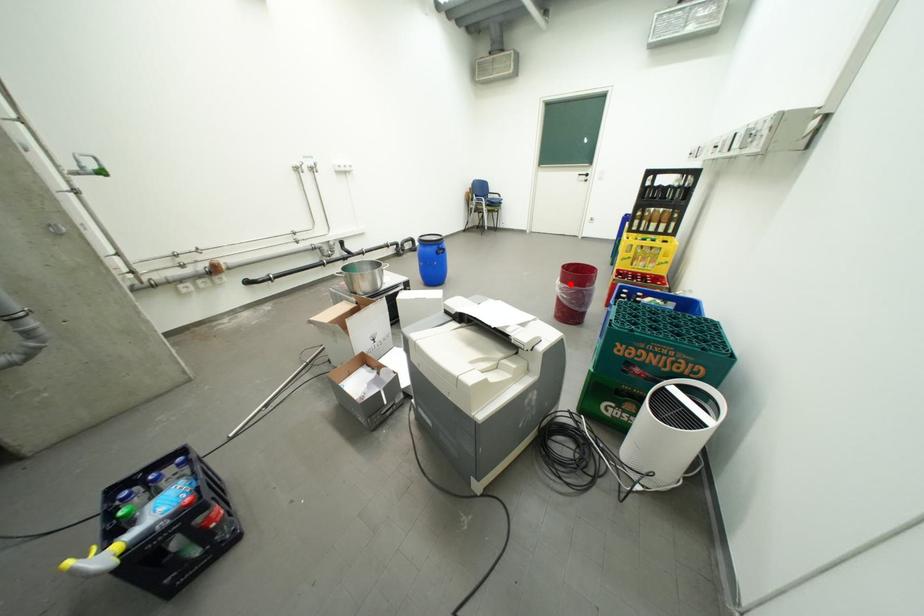
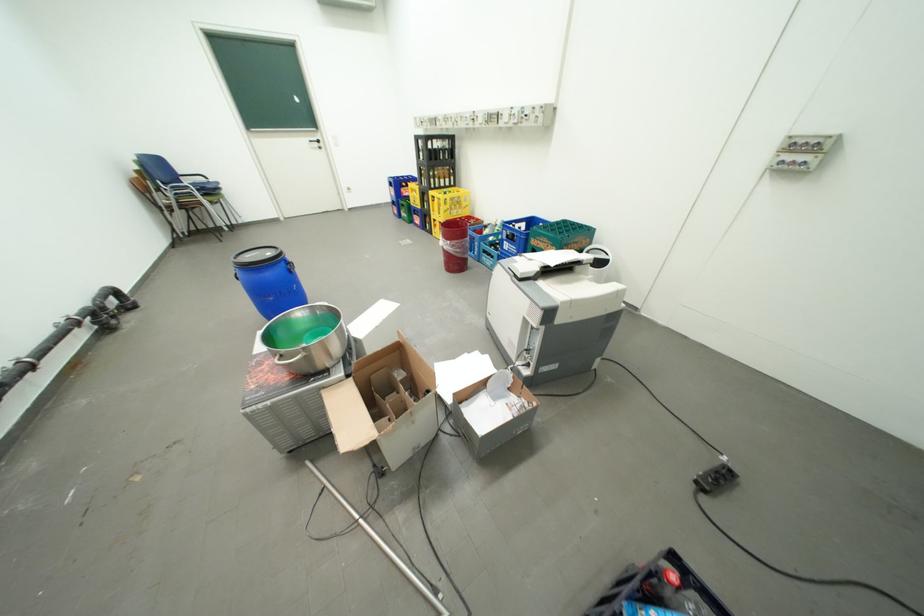
In the second image, find the point that corresponds to the highlighted location in the first image.

(459, 243)